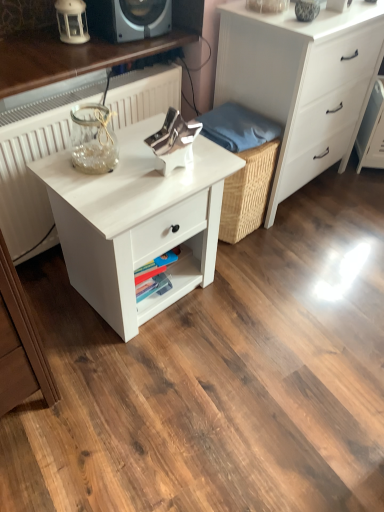
Measure the distance between white matte nightstand at center and camera.

The depth of white matte nightstand at center is 1.19 meters.

Where is `white matte nightstand at center`? This screenshot has height=512, width=384. white matte nightstand at center is located at coordinates (137, 222).

In the scene shown: From the image's perspective, between white matte nightstand at center and white textured radiator at left, who is located below?

white matte nightstand at center, from the image's perspective.

Is white matte nightstand at center taller than white textured radiator at left?

In fact, white matte nightstand at center may be shorter than white textured radiator at left.

Measure the distance between white matte nightstand at center and white textured radiator at left.

white matte nightstand at center and white textured radiator at left are 14.10 inches apart.

Consider the image. Is white matte nightstand at center next to white textured radiator at left?

They are not placed beside each other.

Considering the relative positions of blue fabric at center and white textured radiator at left in the image provided, is blue fabric at center to the left or to the right of white textured radiator at left?

Based on their positions, blue fabric at center is located to the right of white textured radiator at left.

Who is more distant, blue fabric at center or white textured radiator at left?

blue fabric at center is further from the camera.

Looking at this image, is blue fabric at center aimed at white textured radiator at left?

No, blue fabric at center is not facing towards white textured radiator at left.

Is point (241, 123) behind point (23, 241)?

Yes, it is behind point (23, 241).

Which is behind, point (248, 95) or point (213, 121)?

Point (248, 95)

Are white matte chest of drawers at center and blue fabric at center making contact?

white matte chest of drawers at center is not next to blue fabric at center, and they're not touching.

Who is taller, white matte chest of drawers at center or blue fabric at center?

Standing taller between the two is white matte chest of drawers at center.

Is white matte chest of drawers at center at the right side of white textured radiator at left?

Yes, white matte chest of drawers at center is to the right of white textured radiator at left.

What's the angular difference between white matte chest of drawers at center and white textured radiator at left's facing directions?

The facing directions of white matte chest of drawers at center and white textured radiator at left are 1.81 degrees apart.

Based on the photo, looking at the image, does white matte chest of drawers at center seem bigger or smaller compared to white textured radiator at left?

In the image, white matte chest of drawers at center appears to be smaller than white textured radiator at left.

Is point (284, 123) positioned before point (64, 145)?

No, (284, 123) is further to viewer.

Considering the sizes of objects white matte nightstand at center and white matte chest of drawers at center in the image provided, who is wider, white matte nightstand at center or white matte chest of drawers at center?

With larger width is white matte chest of drawers at center.

Considering the relative sizes of white matte nightstand at center and white matte chest of drawers at center in the image provided, is white matte nightstand at center smaller than white matte chest of drawers at center?

Yes.

Which point is more forward, [60,204] or [344,42]?

Point [60,204]

Between white matte lantern at upper left and white textured radiator at left, which one has more height?

Standing taller between the two is white textured radiator at left.

I want to click on radiator below the white matte lantern at upper left (from a real-world perspective), so click(x=28, y=170).

Is white textured radiator at left inside white matte lantern at upper left?

Definitely not — white textured radiator at left is not inside white matte lantern at upper left.

Which point is more forward, (372, 8) or (69, 29)?

The point (372, 8) is in front.

Is white matte chest of drawers at center not near white matte lantern at upper left?

Actually, white matte chest of drawers at center and white matte lantern at upper left are a little close together.

This screenshot has height=512, width=384. What are the coordinates of `nightstand located on the right of white textured radiator at left` in the screenshot? It's located at (137, 222).

You are a GUI agent. You are given a task and a screenshot of the screen. Output one action in this format:
    pyautogui.click(x=<x>, y=<y>)
    Task: Click on the material that is above the white textured radiator at left (from a real-world perspective)
    This screenshot has width=384, height=512.
    Given the screenshot: What is the action you would take?
    tap(238, 127)

Looking at the image, which one is located further to white matte chest of drawers at center, blue fabric at center or white textured radiator at left?

white textured radiator at left is further to white matte chest of drawers at center.

Considering their positions, is white textured radiator at left positioned further to white matte lantern at upper left than blue fabric at center?

blue fabric at center lies further to white matte lantern at upper left than the other object.

Estimate the real-world distances between objects in this image. Which object is further from blue fabric at center, white matte nightstand at center or white textured radiator at left?

white matte nightstand at center lies further to blue fabric at center than the other object.

Looking at the image, which one is located closer to white matte chest of drawers at center, white textured radiator at left or white matte lantern at upper left?

white textured radiator at left lies closer to white matte chest of drawers at center than the other object.

When comparing their distances from white matte nightstand at center, does blue fabric at center or white matte chest of drawers at center seem closer?

blue fabric at center lies closer to white matte nightstand at center than the other object.

Estimate the real-world distances between objects in this image. Which object is further from white matte nightstand at center, white textured radiator at left or white matte chest of drawers at center?

white matte chest of drawers at center is further to white matte nightstand at center.

From the image, which object appears to be farther from white matte lantern at upper left, white matte nightstand at center or white textured radiator at left?

The object further to white matte lantern at upper left is white matte nightstand at center.

When comparing their distances from white textured radiator at left, does white matte nightstand at center or white matte lantern at upper left seem further?

white matte lantern at upper left is further to white textured radiator at left.

I want to click on table lamp between white textured radiator at left and white matte chest of drawers at center in the horizontal direction, so click(72, 21).

Identify the location of material that lies between white matte lantern at upper left and white matte nightstand at center from top to bottom. The width and height of the screenshot is (384, 512). (238, 127).

Find the location of a particular element. The image size is (384, 512). nightstand located between white matte lantern at upper left and white matte chest of drawers at center in the left-right direction is located at coordinates (137, 222).

You are a GUI agent. You are given a task and a screenshot of the screen. Output one action in this format:
    pyautogui.click(x=<x>, y=<y>)
    Task: Click on the material located between white textured radiator at left and white matte chest of drawers at center in the left-right direction
    
    Given the screenshot: What is the action you would take?
    pyautogui.click(x=238, y=127)